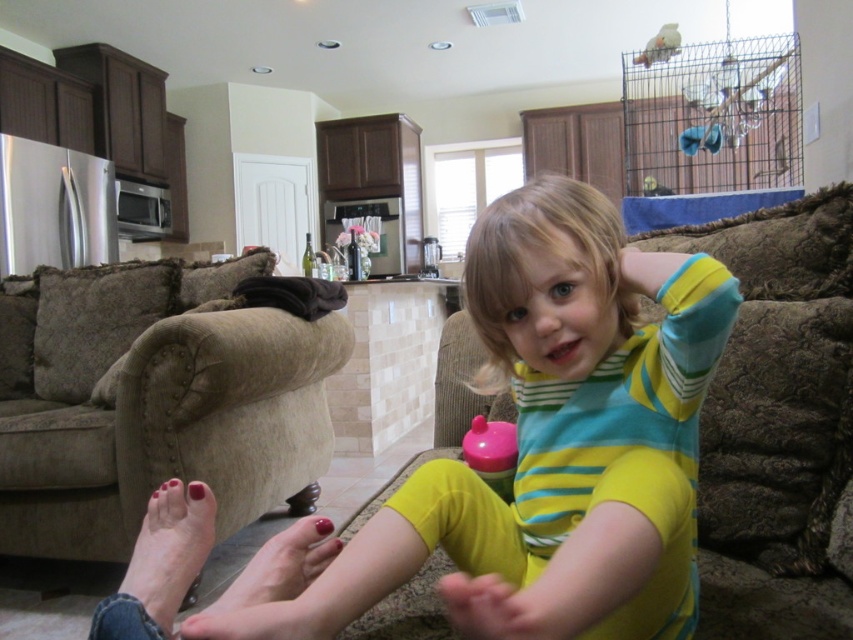
You are a parent trying to decide what to wear for a family photo. You see the yellow striped shirt at center and the matte skin foot at lower left in the scene. Which item is higher up in the image?

The yellow striped shirt at center is taller than the matte skin foot at lower left, so the yellow striped shirt at center is higher up in the image.

You are a photographer taking a picture of the scene. You need to focus on the yellow striped shirt at center and the smooth skin foot at lower left. Which object should you adjust your camera to be closer to first if you want to capture both in focus without moving the camera?

The yellow striped shirt at center is to the right of the smooth skin foot at lower left, so you should adjust your camera to focus on the smooth skin foot at lower left first since it is closer to the camera and then adjust to the yellow striped shirt at center.

What are the coordinates of the yellow striped shirt at center?

The coordinates of the yellow striped shirt at center are at point (x=550, y=444).